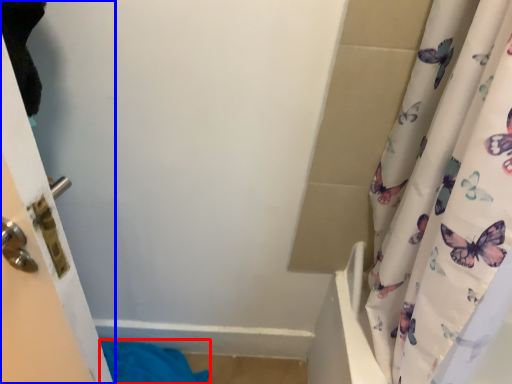
Question: Which of the following is the closest to the observer, bath towel (highlighted by a red box) or door (highlighted by a blue box)?

Choices:
 (A) bath towel
 (B) door

Answer: (B)